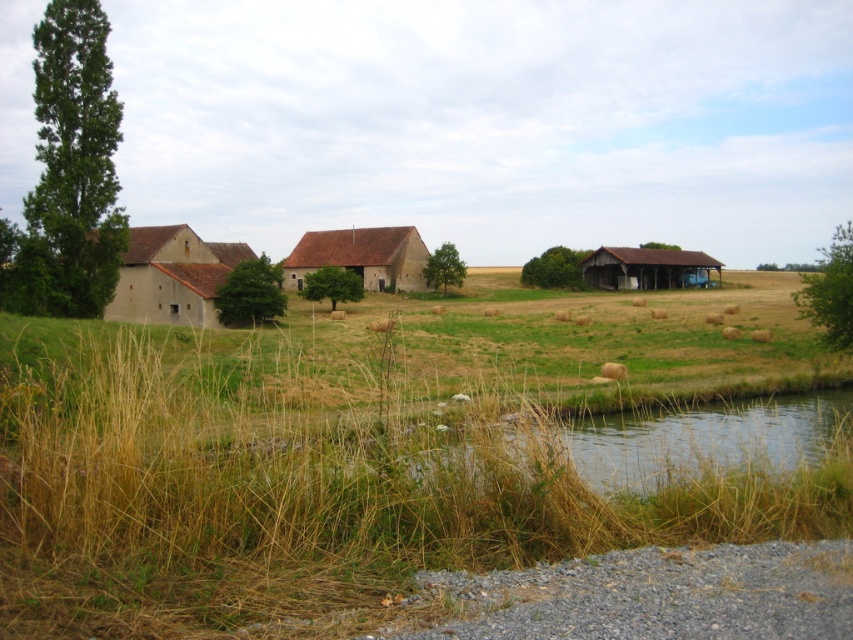
Question: Can you confirm if dry grass at lower left is positioned above brown wooden barn at right?

Choices:
 (A) yes
 (B) no

Answer: (B)

Question: Does dry grass at lower left appear on the right side of beige stucco barn at left?

Choices:
 (A) yes
 (B) no

Answer: (A)

Question: Estimate the real-world distances between objects in this image. Which object is closer to the dry grass at lower left?

Choices:
 (A) brown stone barn at center
 (B) beige stucco barn at left

Answer: (B)

Question: Which point is closer to the camera?

Choices:
 (A) (378, 236)
 (B) (701, 417)
 (C) (662, 259)

Answer: (B)

Question: Does beige stucco barn at left appear on the right side of brown wooden barn at right?

Choices:
 (A) no
 (B) yes

Answer: (A)

Question: Which object is closer to the camera taking this photo?

Choices:
 (A) brown stone barn at center
 (B) brown wooden barn at right

Answer: (A)